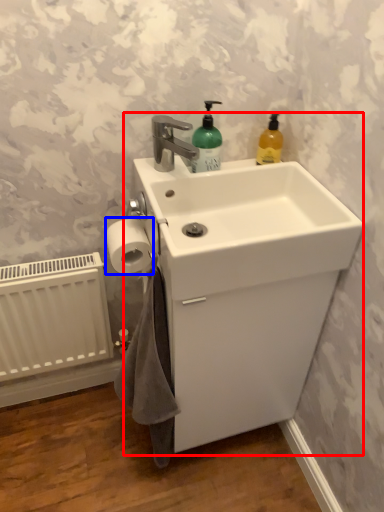
Question: Among these objects, which one is nearest to the camera, sink (highlighted by a red box) or toilet paper (highlighted by a blue box)?

Choices:
 (A) sink
 (B) toilet paper

Answer: (A)